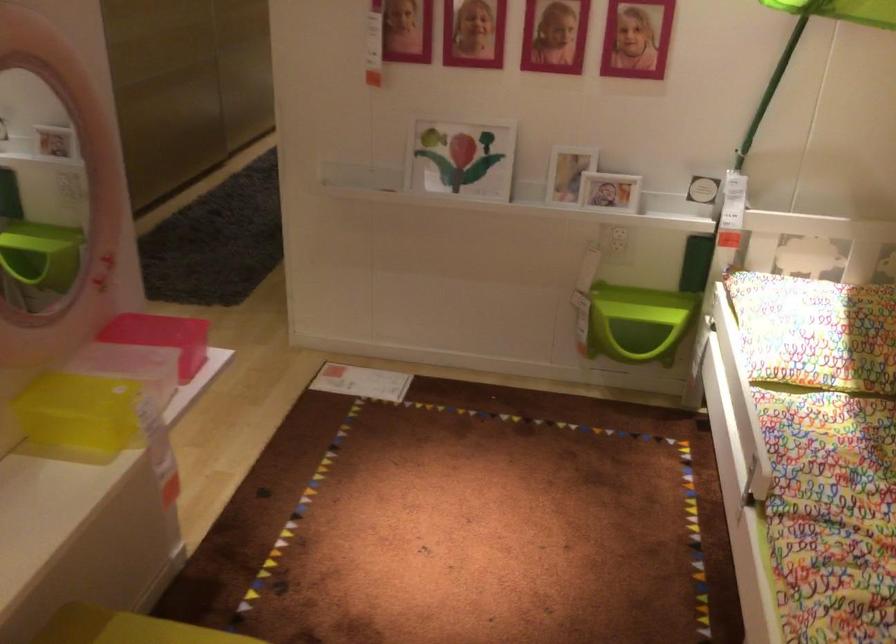
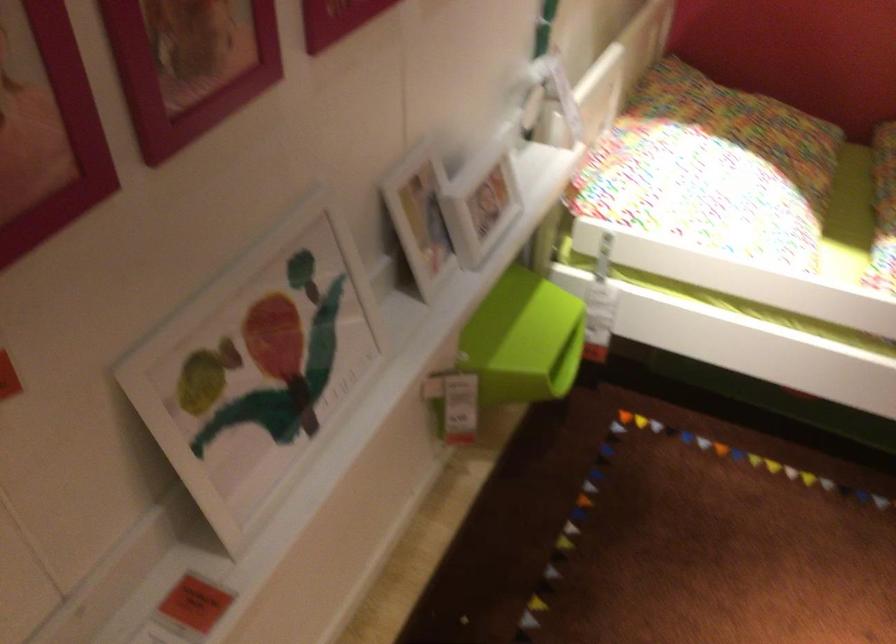
Locate, in the second image, the point that corresponds to (437,160) in the first image.

(257, 368)